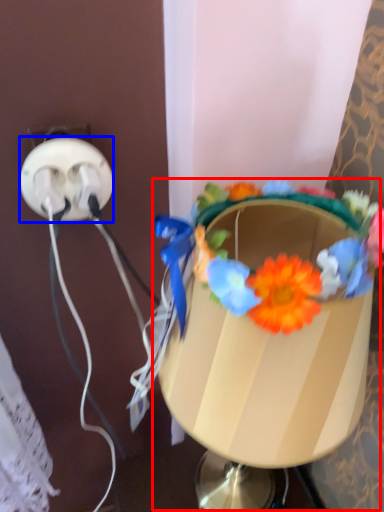
Question: Which point is closer to the camera, table lamp (highlighted by a red box) or power plugs and sockets (highlighted by a blue box)?

Choices:
 (A) table lamp
 (B) power plugs and sockets

Answer: (A)